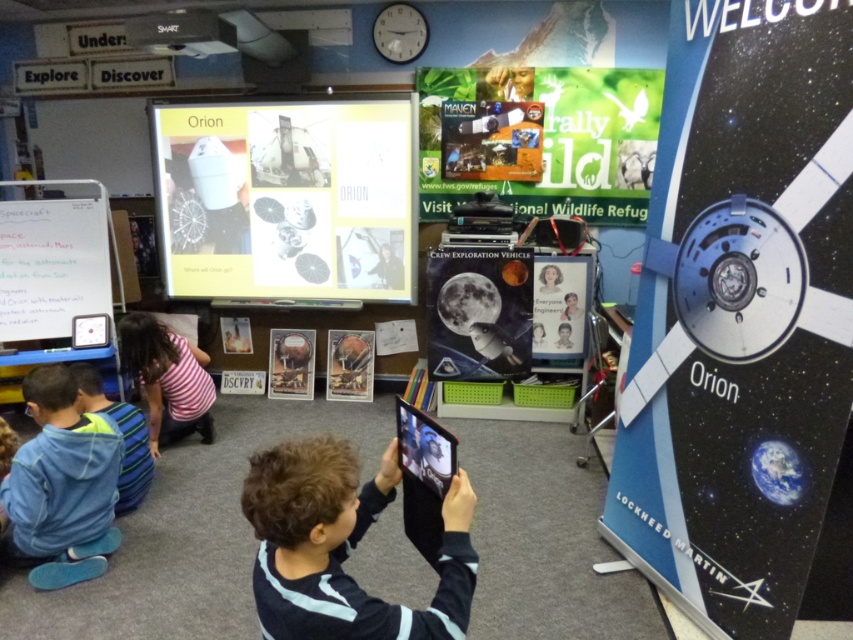
You are a student in the classroom and notice the blue fleece jacket at lower left and the whiteboard at left. Which object takes up more space in the image?

The blue fleece jacket at lower left is bigger than the whiteboard at left, so it takes up more space in the image.